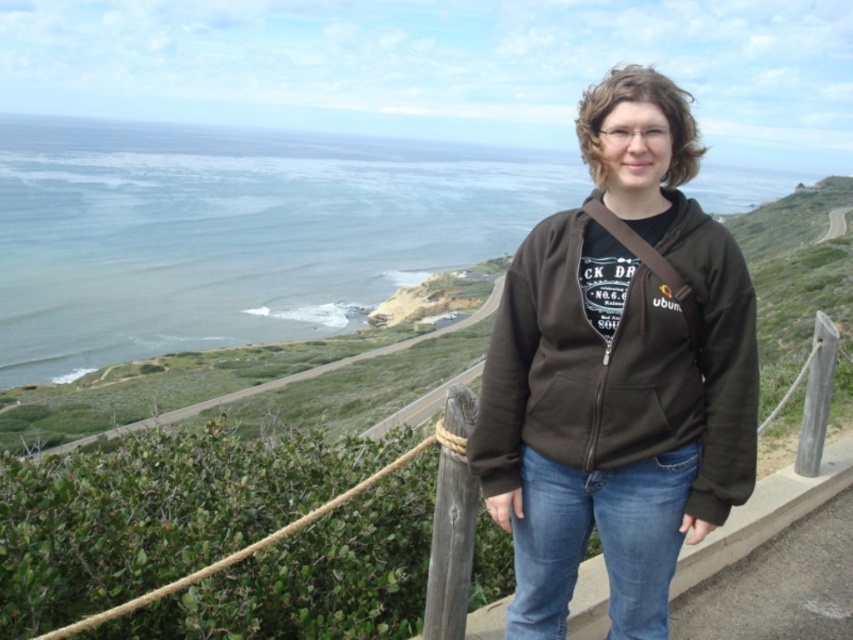
Between dark brown fleece sweatshirt at center and blue denim jeans at lower center, which one appears on the left side from the viewer's perspective?

From the viewer's perspective, blue denim jeans at lower center appears more on the left side.

Is dark brown fleece sweatshirt at center shorter than blue denim jeans at lower center?

In fact, dark brown fleece sweatshirt at center may be taller than blue denim jeans at lower center.

Locate an element on the screen. This screenshot has width=853, height=640. dark brown fleece sweatshirt at center is located at coordinates (624, 364).